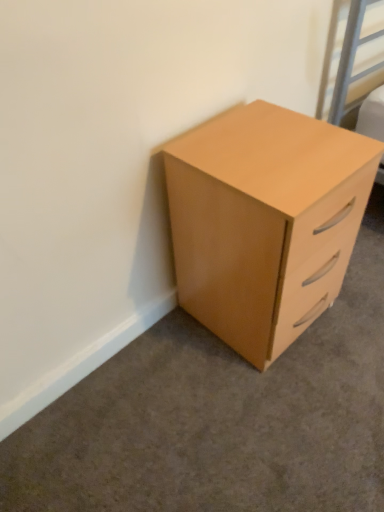
At what (x,y) coordinates should I click in order to perform the action: click on light brown wood chest of drawers at lower right. Please return your answer as a coordinate pair (x, y). The image size is (384, 512). Looking at the image, I should click on (265, 222).

Describe the element at coordinates (265, 222) in the screenshot. I see `light brown wood chest of drawers at lower right` at that location.

Where is `light brown wood chest of drawers at lower right`? light brown wood chest of drawers at lower right is located at coordinates (265, 222).